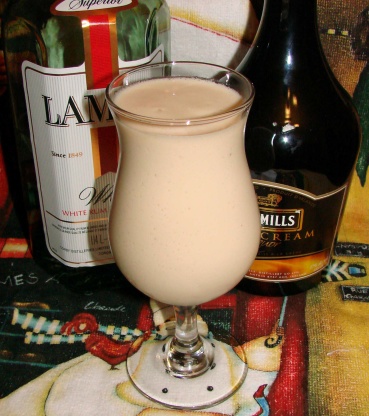
This screenshot has width=369, height=416. Find the location of `glass cup`. glass cup is located at coordinates (158, 199).